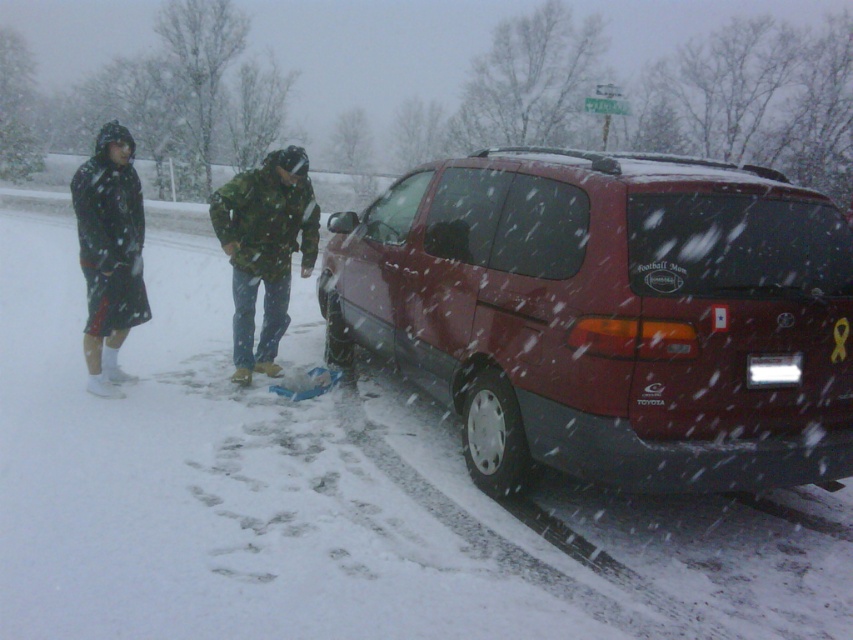
Question: Is camouflage fabric jacket at center to the left of matte black jacket at left from the viewer's perspective?

Choices:
 (A) no
 (B) yes

Answer: (A)

Question: Which object is the farthest from the camouflage fabric jacket at center?

Choices:
 (A) matte black jacket at left
 (B) matte red minivan at center

Answer: (B)

Question: Which point appears closest to the camera in this image?

Choices:
 (A) (262, 275)
 (B) (817, 390)

Answer: (B)

Question: Based on their relative distances, which object is nearer to the matte red minivan at center?

Choices:
 (A) camouflage fabric jacket at center
 (B) matte black jacket at left

Answer: (A)

Question: Does matte red minivan at center have a smaller size compared to camouflage fabric jacket at center?

Choices:
 (A) no
 (B) yes

Answer: (A)

Question: In this image, where is matte red minivan at center located relative to matte black jacket at left?

Choices:
 (A) above
 (B) below

Answer: (B)